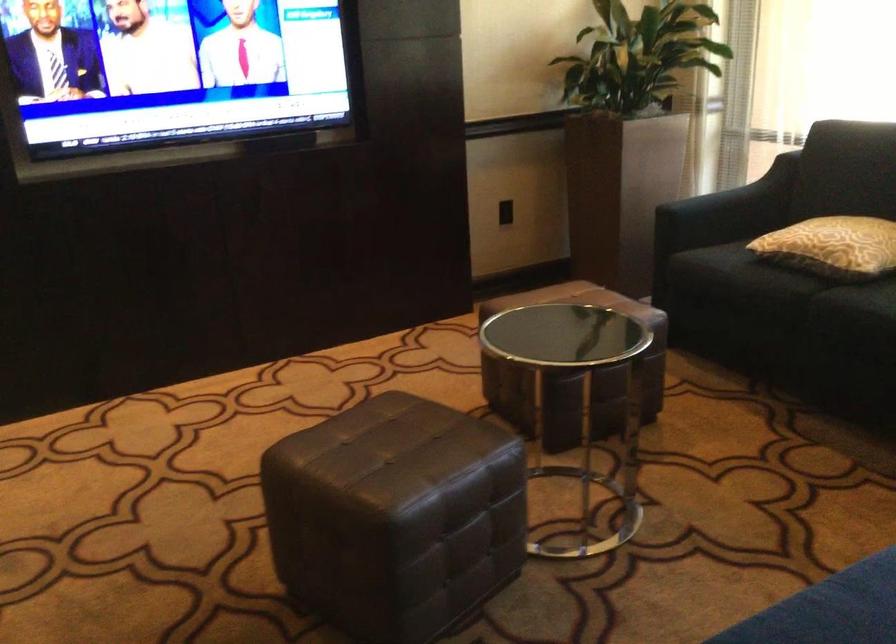
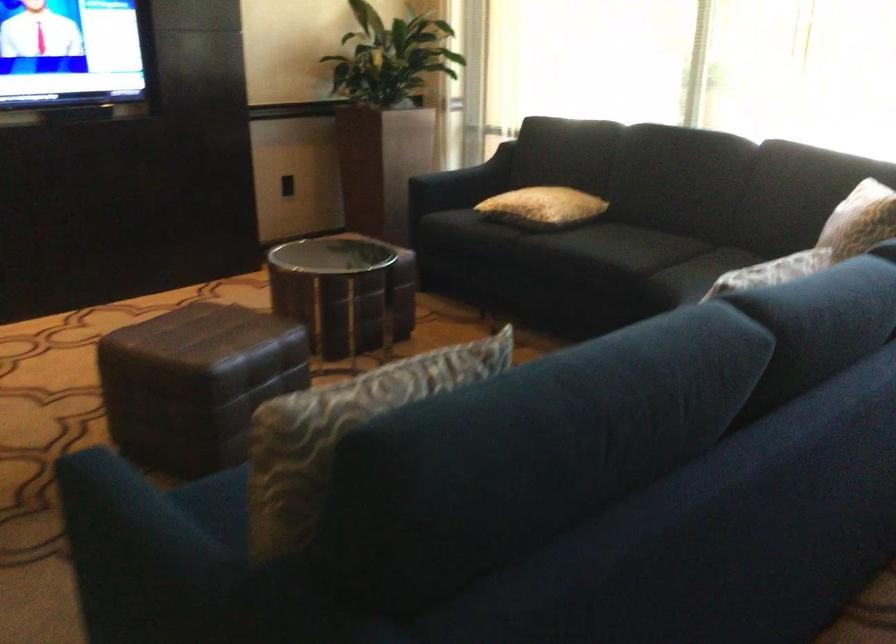
Where in the second image is the point corresponding to [726,210] from the first image?

(460, 184)